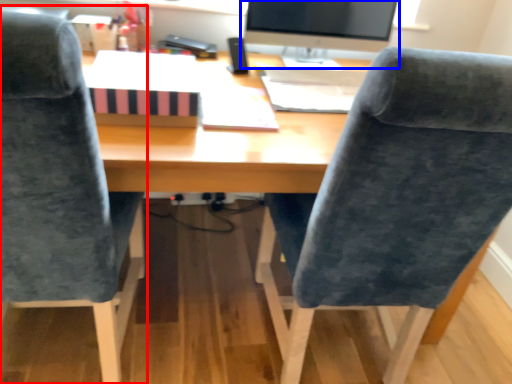
Question: Which object is closer to the camera taking this photo, chair (highlighted by a red box) or computer monitor (highlighted by a blue box)?

Choices:
 (A) chair
 (B) computer monitor

Answer: (A)